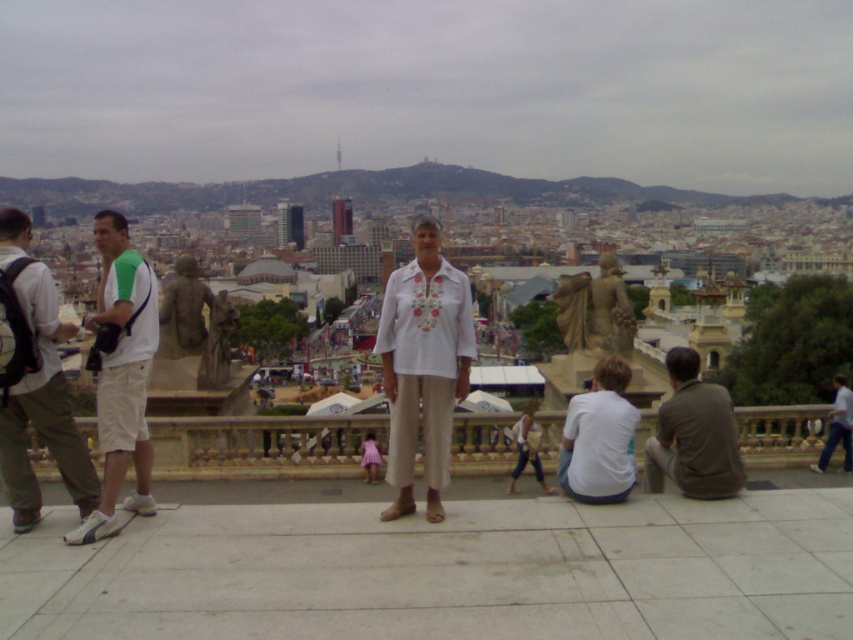
You are a photographer trying to capture a group photo of the blue fabric shirt at lower right and the white cotton shirt at center. Since you want both shirts to appear equally sized in the photo, which subject should you move closer to the camera?

The blue fabric shirt at lower right has a lesser width compared to the white cotton shirt at center. To make them appear equally sized in the photo, you should move the blue fabric shirt at lower right closer to the camera while keeping the white cotton shirt at center at its current position.

You are standing on the balcony and want to hand a small item to both the person wearing the white cotton shirt at lower right and the blue fabric shirt at lower right. Given that the distance between them is 14.60 meters, can you throw the item to both without moving from your spot?

The white cotton shirt at lower right and blue fabric shirt at lower right are 14.60 meters apart. Since the distance between them is over 14 meters, you would need to throw the item twice to reach both individuals, as you can only target one at a time from your current position.